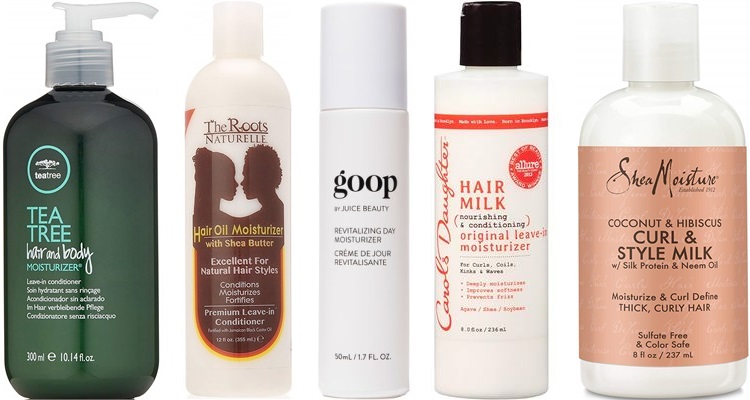
Identify the location of bottles with caps. The width and height of the screenshot is (750, 400). (88, 160), (214, 151), (373, 104), (735, 125), (511, 146).